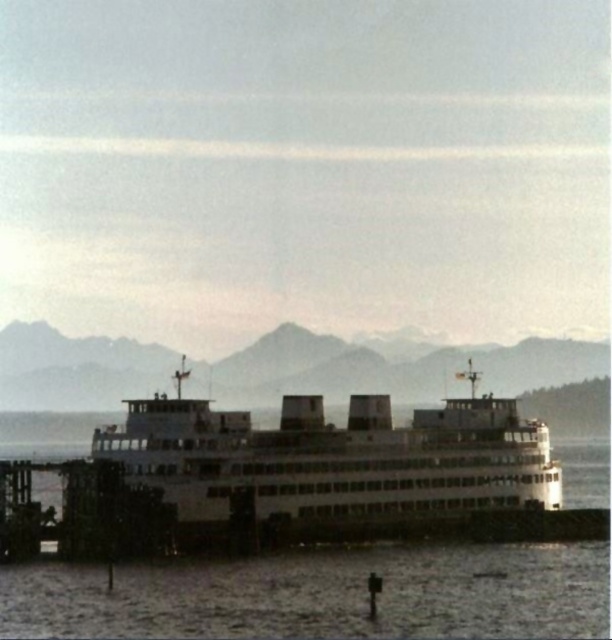
Based on the photo, does white matte ferry at center appear on the left side of white matte water at center?

Correct, you'll find white matte ferry at center to the left of white matte water at center.

Does point (518, 477) lie behind point (578, 586)?

That is True.

You are a GUI agent. You are given a task and a screenshot of the screen. Output one action in this format:
    pyautogui.click(x=<x>, y=<y>)
    Task: Click on the white matte ferry at center
    The height and width of the screenshot is (640, 612).
    Given the screenshot: What is the action you would take?
    pyautogui.click(x=318, y=470)